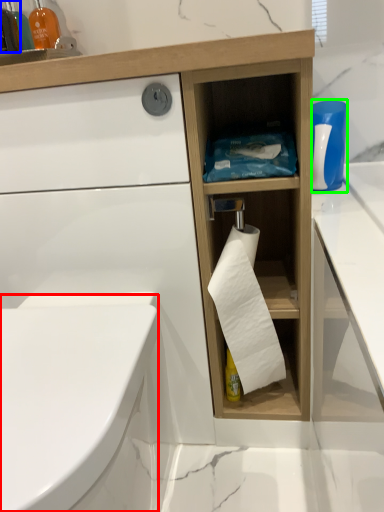
Question: Which object is positioned closest to bidet (highlighted by a red box)? Select from bottle (highlighted by a blue box) and cleaning product (highlighted by a green box).

Choices:
 (A) bottle
 (B) cleaning product

Answer: (B)